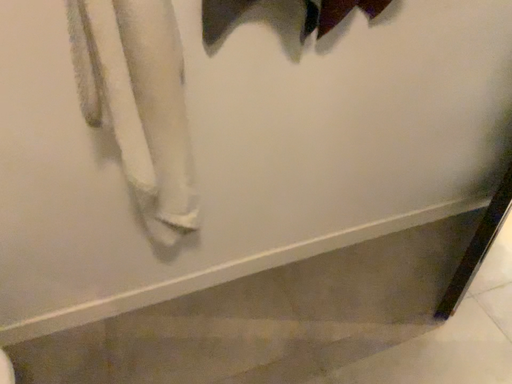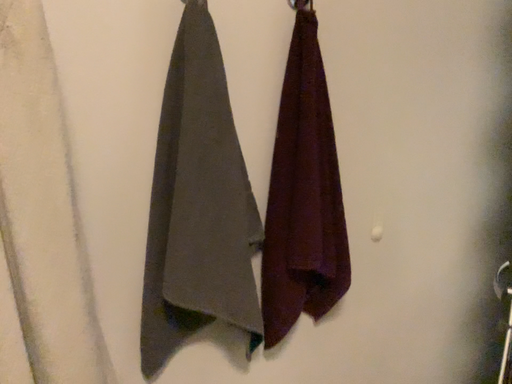
Question: How did the camera likely rotate when shooting the video?

Choices:
 (A) rotated upward
 (B) rotated downward

Answer: (A)